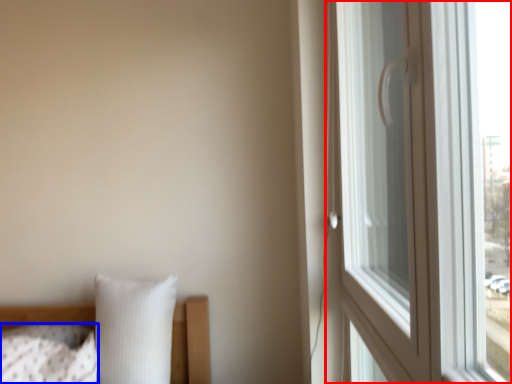
Question: Among these objects, which one is nearest to the camera, window (highlighted by a red box) or pillow (highlighted by a blue box)?

Choices:
 (A) window
 (B) pillow

Answer: (A)